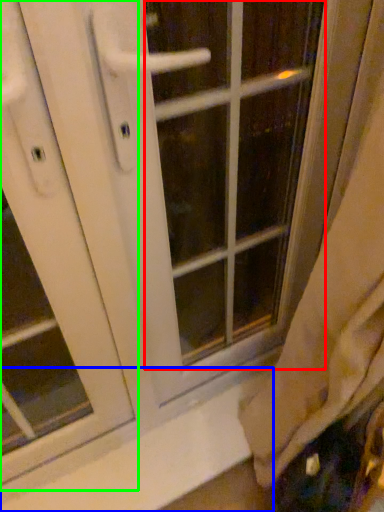
Question: Which is farther away from glass door (highlighted by a red box)? window sill (highlighted by a blue box) or screen door (highlighted by a green box)?

Choices:
 (A) window sill
 (B) screen door

Answer: (B)